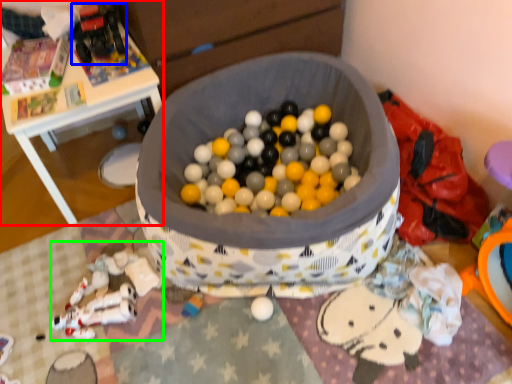
Question: Which object is positioned closest to table (highlighted by a red box)? Select from toy (highlighted by a blue box) and toy (highlighted by a green box).

Choices:
 (A) toy
 (B) toy

Answer: (A)